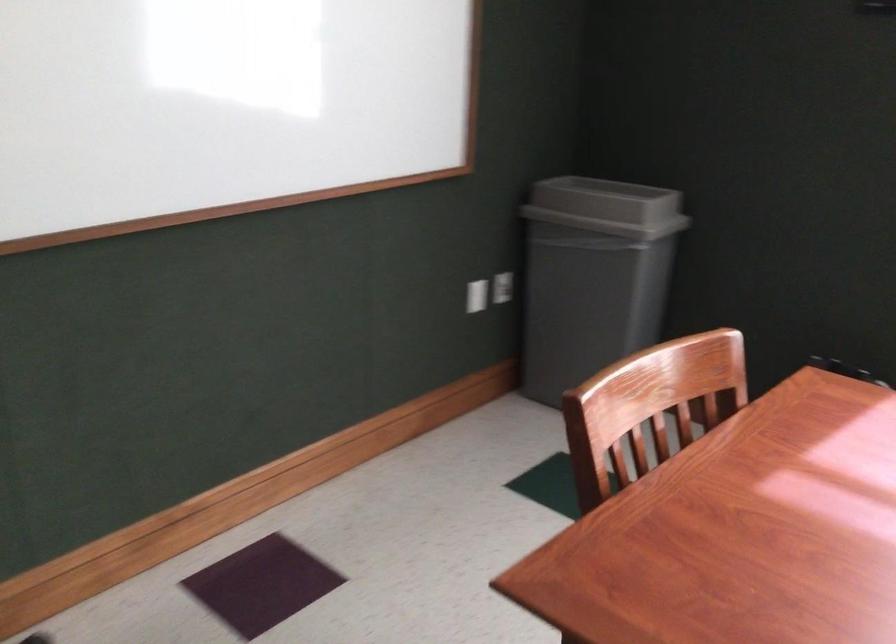
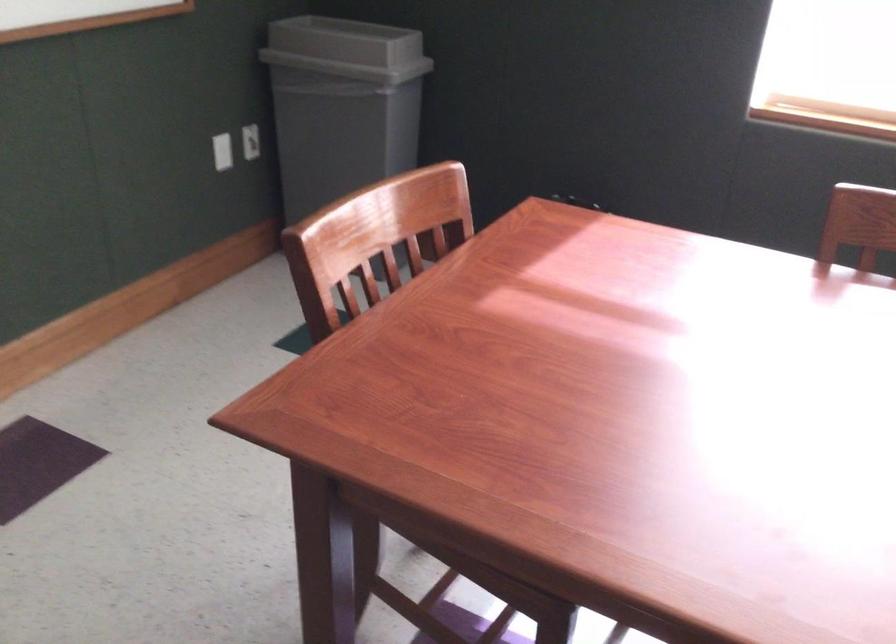
Question: The images are taken continuously from a first-person perspective. In which direction is your viewpoint rotating?

Choices:
 (A) Left
 (B) Right
 (C) Up
 (D) Down

Answer: (B)